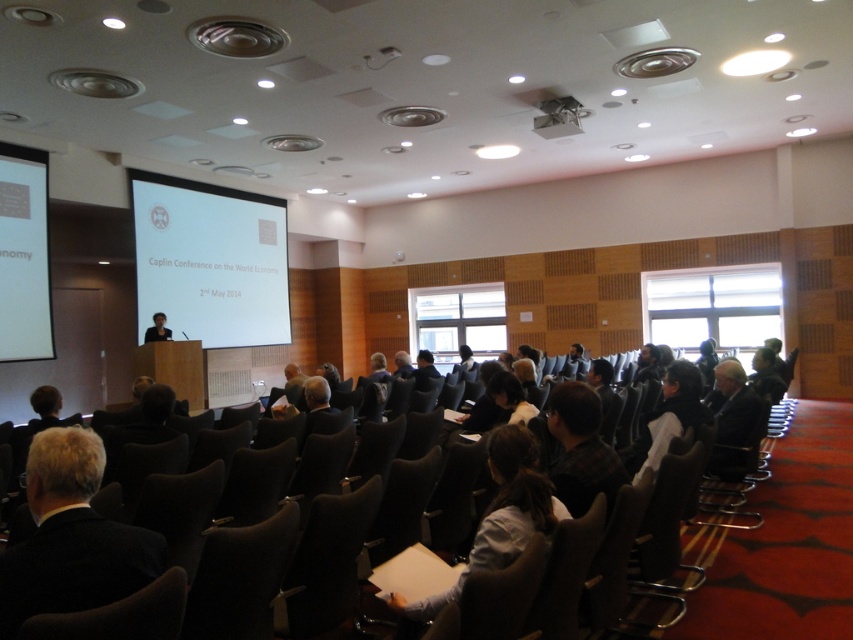
You are organizing a small meeting for 5 people in this conference room. The black leather chair at center and the white glossy projector screen at left are already placed. Can you fit an additional rectangular table that measures 1.5 meters in length between them?

The black leather chair at center occupies less space than the white glossy projector screen at left. Since the chair takes up less space, there might be enough room to place the table between them. However, without knowing the exact dimensions of the available space, it is difficult to confirm. Consider measuring the distance between the two objects before deciding.

You are organizing a conference and need to ensure that the light blue shirt at center and the black fabric person at center can hear each other during a discussion. Given that the minimum required distance for clear audio transmission between two people is 25 feet, will they be able to hear each other comfortably?

The light blue shirt at center and black fabric person at center are 25.51 feet apart, which exceeds the minimum required distance of 25 feet. Therefore, they will be able to hear each other comfortably.